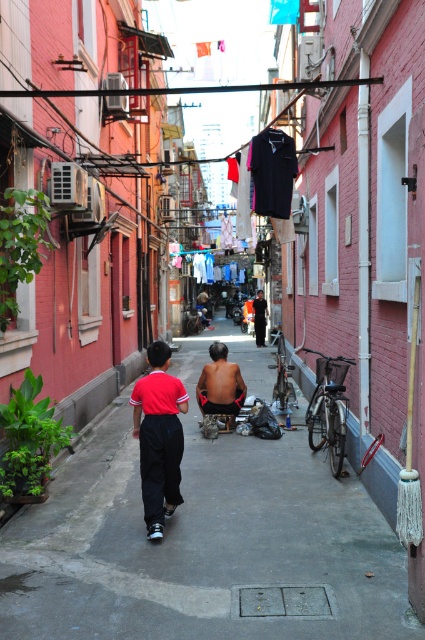
Can you confirm if matte red shirt at center is wider than dark gray fabric jacket at center?

No.

Does matte red shirt at center appear over dark gray fabric jacket at center?

No.

Which is in front, point (158, 420) or point (257, 301)?

Point (158, 420) is more forward.

The image size is (425, 640). What are the coordinates of `matte red shirt at center` in the screenshot? It's located at (158, 436).

Is point (226, 353) behind point (263, 305)?

No, (226, 353) is in front of (263, 305).

Is skinny man at center positioned in front of dark gray fabric jacket at center?

Yes.

Does point (206, 406) come behind point (261, 292)?

No, it is not.

The height and width of the screenshot is (640, 425). Identify the location of skinny man at center. (220, 384).

Is smooth concrete pavement at center in front of dark gray fabric jacket at center?

Yes, smooth concrete pavement at center is closer to the viewer.

Which is more to the left, smooth concrete pavement at center or dark gray fabric jacket at center?

smooth concrete pavement at center

Between point (394, 609) and point (255, 328), which one is positioned behind?

Point (255, 328)

I want to click on smooth concrete pavement at center, so click(x=204, y=540).